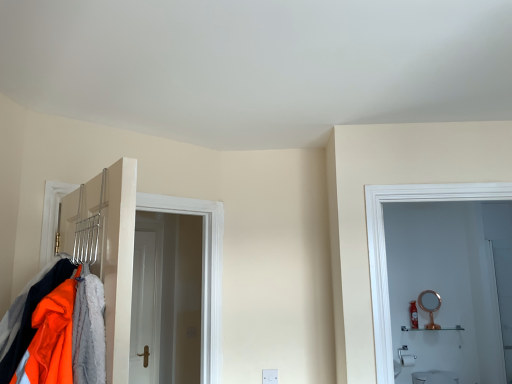
Question: Is white glossy shelf at right turned away from rose gold metallic mirror at right?

Choices:
 (A) yes
 (B) no

Answer: (B)

Question: Does white glossy shelf at right have a greater height compared to rose gold metallic mirror at right?

Choices:
 (A) no
 (B) yes

Answer: (A)

Question: Is white glossy shelf at right at the left side of rose gold metallic mirror at right?

Choices:
 (A) yes
 (B) no

Answer: (A)

Question: Is white glossy shelf at right to the right of rose gold metallic mirror at right from the viewer's perspective?

Choices:
 (A) yes
 (B) no

Answer: (B)

Question: Is white glossy shelf at right thinner than rose gold metallic mirror at right?

Choices:
 (A) no
 (B) yes

Answer: (A)

Question: From a real-world perspective, is white glossy shelf at right beneath rose gold metallic mirror at right?

Choices:
 (A) no
 (B) yes

Answer: (B)

Question: Is rose gold metallic mirror at right touching metallic silver coat rack at left?

Choices:
 (A) no
 (B) yes

Answer: (A)

Question: Could metallic silver coat rack at left be considered to be inside rose gold metallic mirror at right?

Choices:
 (A) no
 (B) yes

Answer: (A)

Question: From a real-world perspective, is rose gold metallic mirror at right physically above metallic silver coat rack at left?

Choices:
 (A) no
 (B) yes

Answer: (A)

Question: Is rose gold metallic mirror at right not inside metallic silver coat rack at left?

Choices:
 (A) no
 (B) yes

Answer: (B)

Question: Can you confirm if rose gold metallic mirror at right is smaller than metallic silver coat rack at left?

Choices:
 (A) yes
 (B) no

Answer: (A)

Question: From the image's perspective, is rose gold metallic mirror at right located above metallic silver coat rack at left?

Choices:
 (A) no
 (B) yes

Answer: (A)

Question: Is rose gold metallic mirror at right wider than white glossy shelf at right?

Choices:
 (A) no
 (B) yes

Answer: (A)